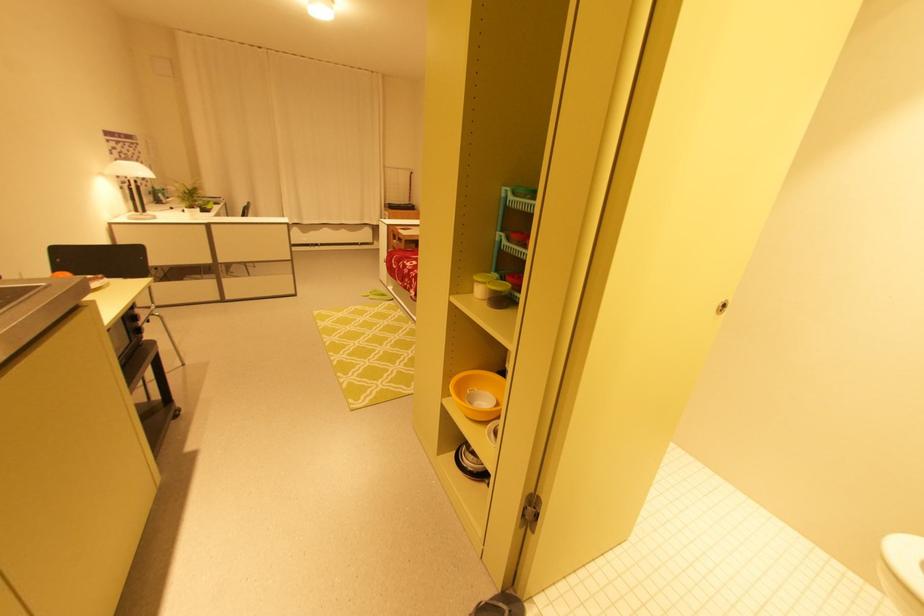
Find the location of a particular element. yellow bowl is located at coordinates (478, 394).